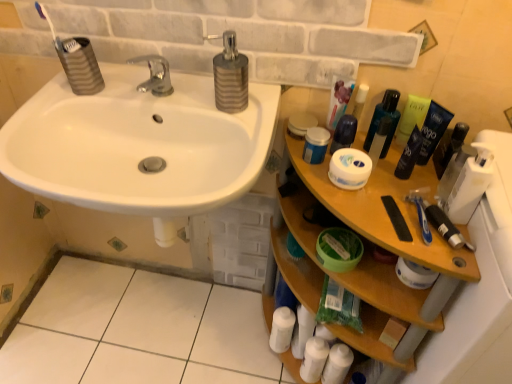
Where is `free space in front of white matte jar at upper right, which ranks as the seventh mouthwash in right-to-left order`? This screenshot has width=512, height=384. free space in front of white matte jar at upper right, which ranks as the seventh mouthwash in right-to-left order is located at coordinates (351, 203).